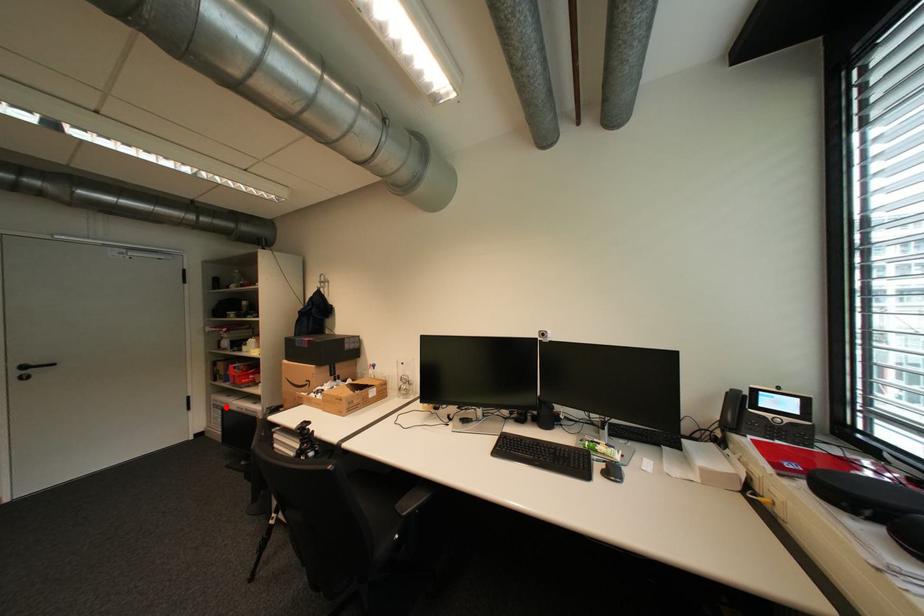
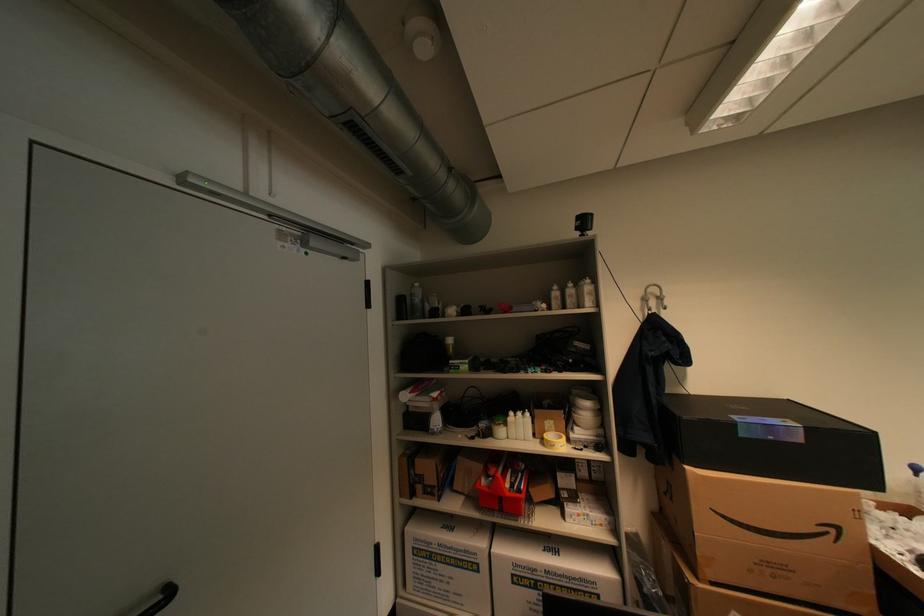
Find the pixel in the second image that matches the highlighted location in the first image.

(439, 556)